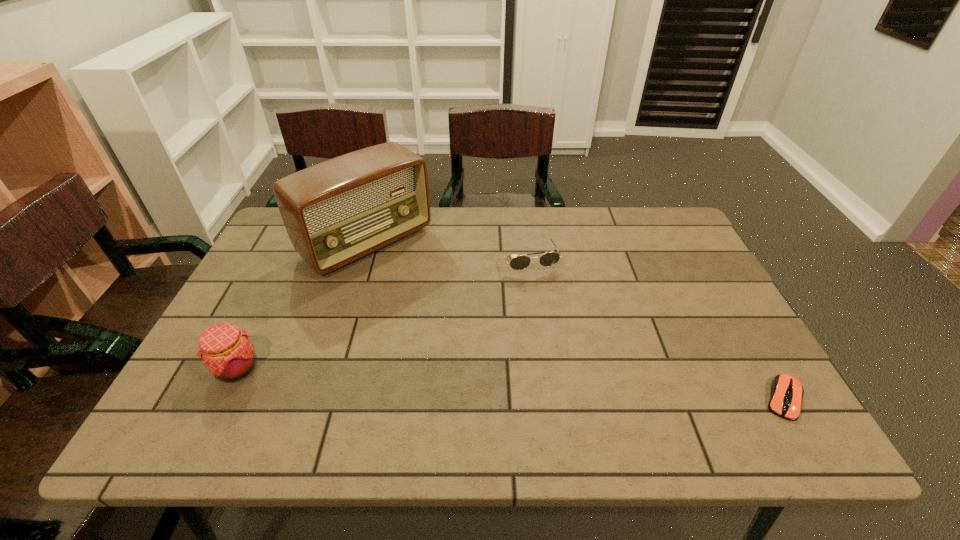
This screenshot has width=960, height=540. I want to click on vacant space that's between the second object from right to left and the computer mouse, so click(656, 329).

Identify the location of free spot between the radio receiver and the sunglasses. This screenshot has height=540, width=960. (447, 251).

The image size is (960, 540). In order to click on unoccupied area between the radio receiver and the jam in this screenshot , I will do `click(302, 306)`.

Identify the location of vacant space in between the third shortest object and the second object from right to left. (382, 314).

Locate an element on the screen. vacant space in between the computer mouse and the third shortest object is located at coordinates pyautogui.click(x=511, y=383).

Image resolution: width=960 pixels, height=540 pixels. Find the location of `blank region between the radio receiver and the rightmost object`. blank region between the radio receiver and the rightmost object is located at coordinates [575, 321].

Identify the location of free space between the computer mouse and the radio receiver. The image size is (960, 540). [575, 321].

Locate an element on the screen. This screenshot has height=540, width=960. blank region between the computer mouse and the jam is located at coordinates (511, 383).

Where is `free space between the second object from right to left and the tallest object`? This screenshot has height=540, width=960. free space between the second object from right to left and the tallest object is located at coordinates (447, 251).

Choose which object is the third nearest neighbor to the second tallest object. Please provide its 2D coordinates. Your answer should be formatted as a tuple, i.e. [(x, y)], where the tuple contains the x and y coordinates of a point satisfying the conditions above.

[(787, 392)]